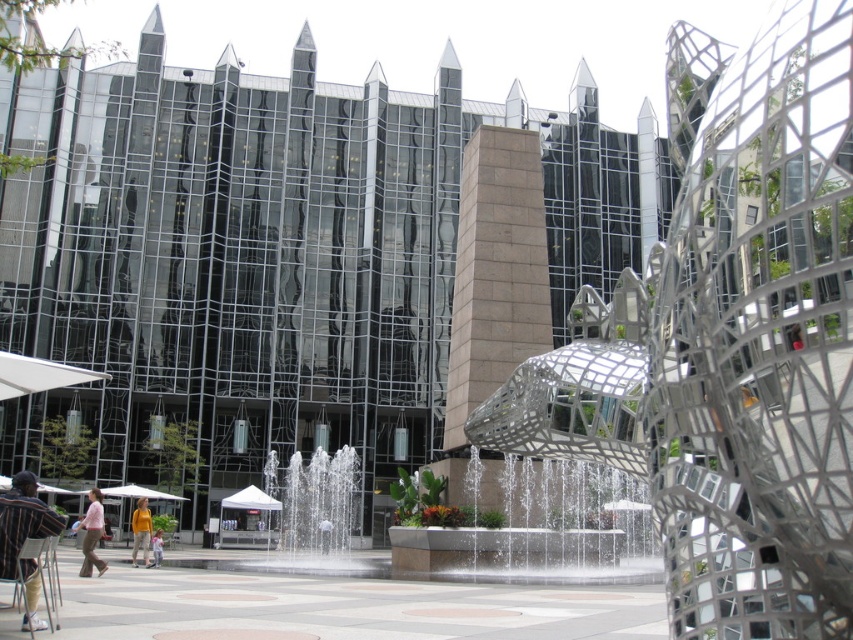
Measure the distance between clear water at center and camera.

clear water at center is 66.53 meters away from camera.

Who is positioned more to the left, clear water at center or white matte umbrella at lower left?

Positioned to the left is white matte umbrella at lower left.

This screenshot has width=853, height=640. Find the location of `clear water at center`. clear water at center is located at coordinates (318, 509).

Is clear water at center to the left of yellow cotton shirt at center from the viewer's perspective?

In fact, clear water at center is to the right of yellow cotton shirt at center.

Is clear water at center smaller than yellow cotton shirt at center?

Incorrect, clear water at center is not smaller in size than yellow cotton shirt at center.

Is point (286, 528) farther from camera compared to point (149, 524)?

Yes.

In order to click on clear water at center in this screenshot , I will do `click(318, 509)`.

Can you confirm if yellow cotton shirt at center is bigger than orange shirt at lower left?

Yes, yellow cotton shirt at center is bigger than orange shirt at lower left.

Between point (149, 531) and point (155, 545), which one is positioned behind?

Point (149, 531)

Between point (134, 531) and point (155, 554), which one is positioned behind?

Point (134, 531)

Identify the location of yellow cotton shirt at center. (141, 531).